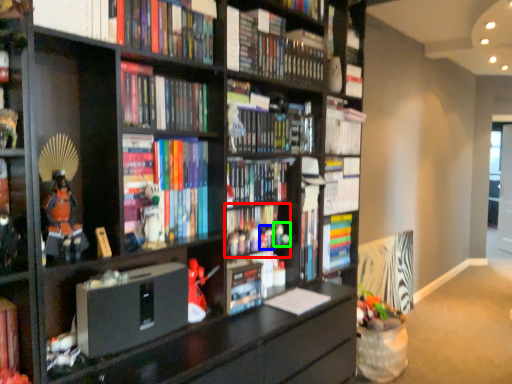
Question: Considering the real-world distances, which object is farthest from book (highlighted by a red box)? toy (highlighted by a blue box) or toy (highlighted by a green box)?

Choices:
 (A) toy
 (B) toy

Answer: (B)